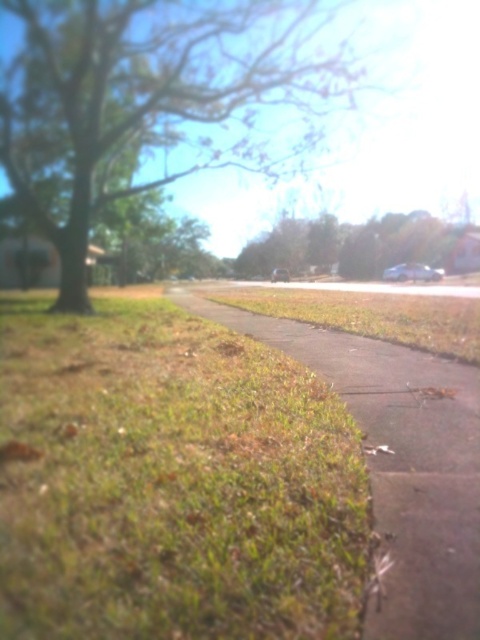
Question: Is green leafy tree at upper left to the left of green leafy tree at center from the viewer's perspective?

Choices:
 (A) no
 (B) yes

Answer: (B)

Question: Which point is closer to the camera?

Choices:
 (A) (134, 552)
 (B) (464, 438)
 (C) (39, 122)
 (D) (244, 248)

Answer: (A)

Question: Which point is farther to the camera?

Choices:
 (A) green leafy tree at center
 (B) green grass at lower left
 (C) green grassy pavement at lower center
 (D) green leafy tree at upper left

Answer: (A)

Question: Among these points, which one is farthest from the camera?

Choices:
 (A) (23, 180)
 (B) (256, 237)

Answer: (B)

Question: Considering the relative positions of green grass at lower left and green leafy tree at center in the image provided, where is green grass at lower left located with respect to green leafy tree at center?

Choices:
 (A) right
 (B) left

Answer: (B)

Question: Does green grass at lower left have a greater width compared to green grassy pavement at lower center?

Choices:
 (A) yes
 (B) no

Answer: (B)